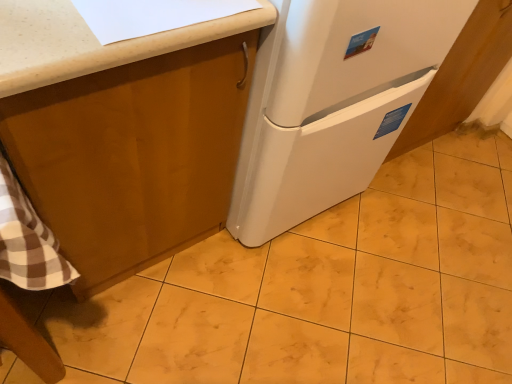
Question: Considering the relative sizes of white glossy cabinet at lower right, the 1th cabinetry in the right-to-left sequence, and yellow marble tile at center in the image provided, is white glossy cabinet at lower right, the 1th cabinetry in the right-to-left sequence, taller than yellow marble tile at center?

Choices:
 (A) no
 (B) yes

Answer: (B)

Question: Considering the relative sizes of white glossy cabinet at lower right, the 1th cabinetry in the right-to-left sequence, and yellow marble tile at center in the image provided, is white glossy cabinet at lower right, the 1th cabinetry in the right-to-left sequence, bigger than yellow marble tile at center?

Choices:
 (A) yes
 (B) no

Answer: (A)

Question: Considering the relative sizes of white glossy cabinet at lower right, the 1th cabinetry in the right-to-left sequence, and yellow marble tile at center in the image provided, is white glossy cabinet at lower right, the 1th cabinetry in the right-to-left sequence, wider than yellow marble tile at center?

Choices:
 (A) no
 (B) yes

Answer: (A)

Question: Does white glossy cabinet at lower right, arranged as the second cabinetry when viewed from the left, appear on the right side of yellow marble tile at center?

Choices:
 (A) yes
 (B) no

Answer: (A)

Question: Is white glossy cabinet at lower right, the 1th cabinetry in the right-to-left sequence, thinner than yellow marble tile at center?

Choices:
 (A) no
 (B) yes

Answer: (B)

Question: From a real-world perspective, relative to white glossy cabinet at lower right, arranged as the second cabinetry when viewed from the left, is white matte refrigerator at center vertically above or below?

Choices:
 (A) below
 (B) above

Answer: (B)

Question: In terms of width, does white matte refrigerator at center look wider or thinner when compared to white glossy cabinet at lower right, arranged as the second cabinetry when viewed from the left?

Choices:
 (A) wide
 (B) thin

Answer: (A)

Question: From the image's perspective, is white matte refrigerator at center located above or below white glossy cabinet at lower right, arranged as the second cabinetry when viewed from the left?

Choices:
 (A) below
 (B) above

Answer: (A)

Question: Based on their sizes in the image, would you say white matte refrigerator at center is bigger or smaller than white glossy cabinet at lower right, the 1th cabinetry in the right-to-left sequence?

Choices:
 (A) small
 (B) big

Answer: (B)

Question: Considering the positions of white matte refrigerator at center and yellow marble tile at center in the image, is white matte refrigerator at center bigger or smaller than yellow marble tile at center?

Choices:
 (A) small
 (B) big

Answer: (B)

Question: Visually, is white matte refrigerator at center positioned to the left or to the right of yellow marble tile at center?

Choices:
 (A) right
 (B) left

Answer: (B)

Question: From the image's perspective, is white matte refrigerator at center located above or below yellow marble tile at center?

Choices:
 (A) above
 (B) below

Answer: (A)

Question: Is white matte refrigerator at center inside the boundaries of yellow marble tile at center, or outside?

Choices:
 (A) inside
 (B) outside

Answer: (B)

Question: Considering the positions of point (114, 92) and point (416, 145), is point (114, 92) closer or farther from the camera than point (416, 145)?

Choices:
 (A) closer
 (B) farther

Answer: (A)

Question: From the image's perspective, relative to white glossy cabinet at lower right, the 1th cabinetry in the right-to-left sequence, is matte wood cabinet at upper left, marked as the first cabinetry in a left-to-right arrangement, above or below?

Choices:
 (A) below
 (B) above

Answer: (A)